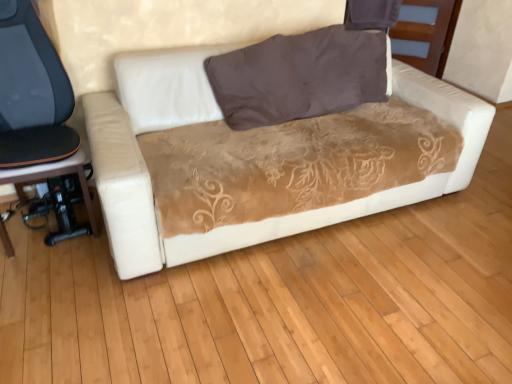
Where is `free spot to the left of black plastic music stool at lower left`? The width and height of the screenshot is (512, 384). free spot to the left of black plastic music stool at lower left is located at coordinates (24, 226).